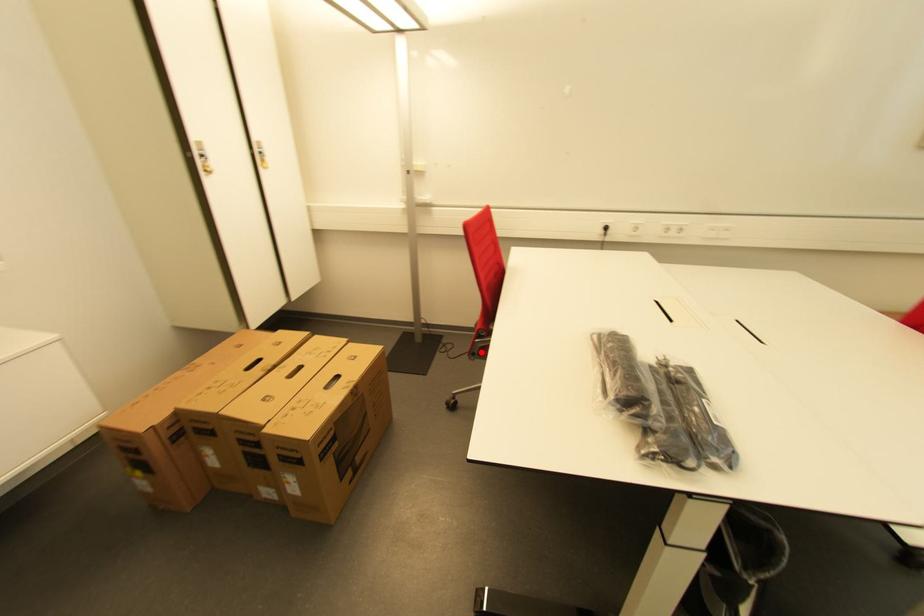
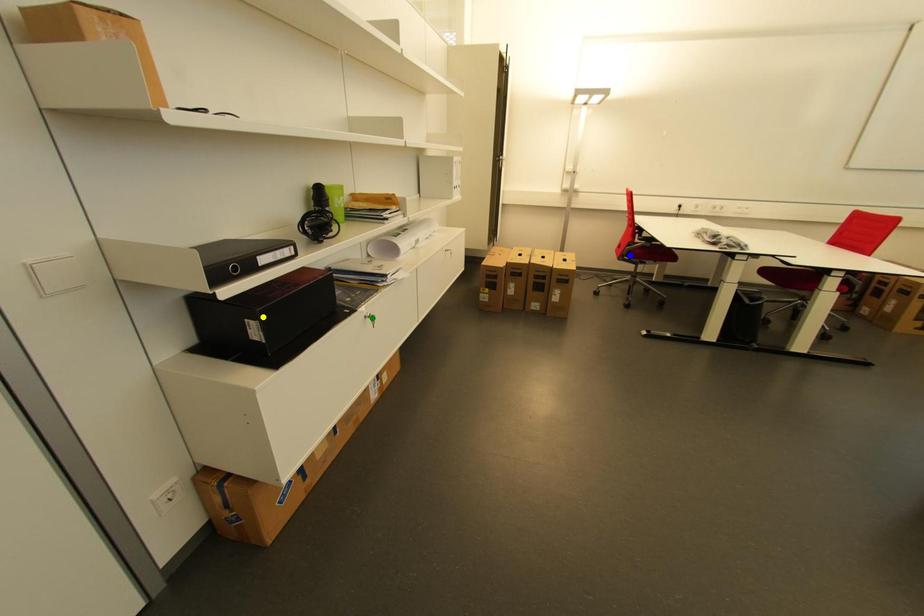
Question: I am providing you with two images of the same scene from different viewpoints. A red point is marked on the first image. You are given multiple points on the second image. Which point in image 2 is actually the same real-world point as the red point in image 1?

Choices:
 (A) green point
 (B) blue point
 (C) yellow point

Answer: (B)